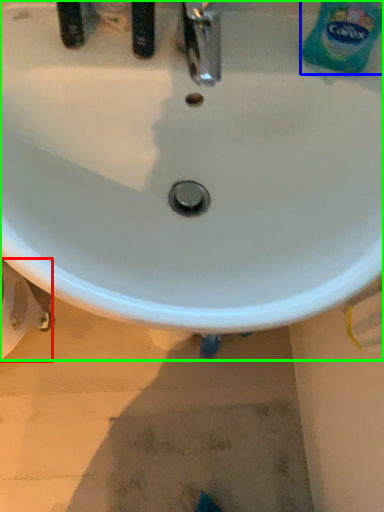
Question: Which object is positioned farthest from bidet (highlighted by a red box)? Select from cleaning product (highlighted by a blue box) and sink (highlighted by a green box).

Choices:
 (A) cleaning product
 (B) sink

Answer: (A)